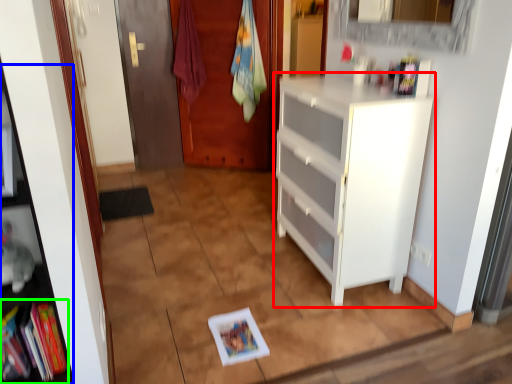
Question: Which is farther away from cabinetry (highlighted by a red box)? cabinet (highlighted by a blue box) or book (highlighted by a green box)?

Choices:
 (A) cabinet
 (B) book

Answer: (B)